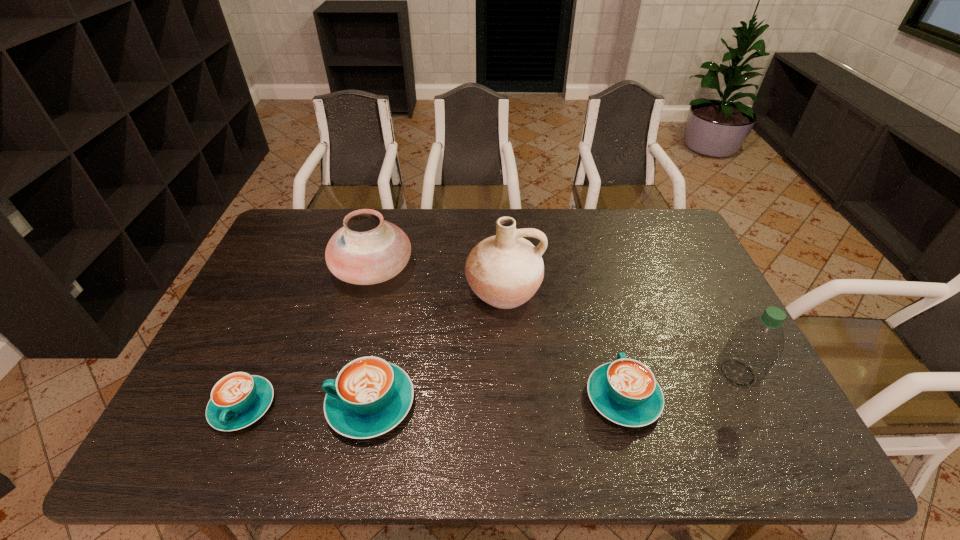
Identify which object is the nearest to the second cappuccino from left to right. Please provide its 2D coordinates. Your answer should be formatted as a tuple, i.e. [(x, y)], where the tuple contains the x and y coordinates of a point satisfying the conditions above.

[(239, 399)]

This screenshot has width=960, height=540. In order to click on the closest object to the shortest object in this screenshot , I will do (370, 396).

Locate an element on the screen. cappuccino that is the second closest one to the shorter pottery is located at coordinates (239, 399).

Identify the location of cappuccino object that ranks as the closest to the rightmost cappuccino. (370, 396).

Where is `free space that satisfies the following two spatial constraints: 1. with the handle on the right side of the second cappuccino from left to right; 2. with the handle on the right side of the shortest cappuccino`? The width and height of the screenshot is (960, 540). free space that satisfies the following two spatial constraints: 1. with the handle on the right side of the second cappuccino from left to right; 2. with the handle on the right side of the shortest cappuccino is located at coordinates (371, 406).

Identify the location of vacant space that satisfies the following two spatial constraints: 1. to pour from the handle of the rightmost object; 2. on the right side of the right pottery. Image resolution: width=960 pixels, height=540 pixels. (508, 373).